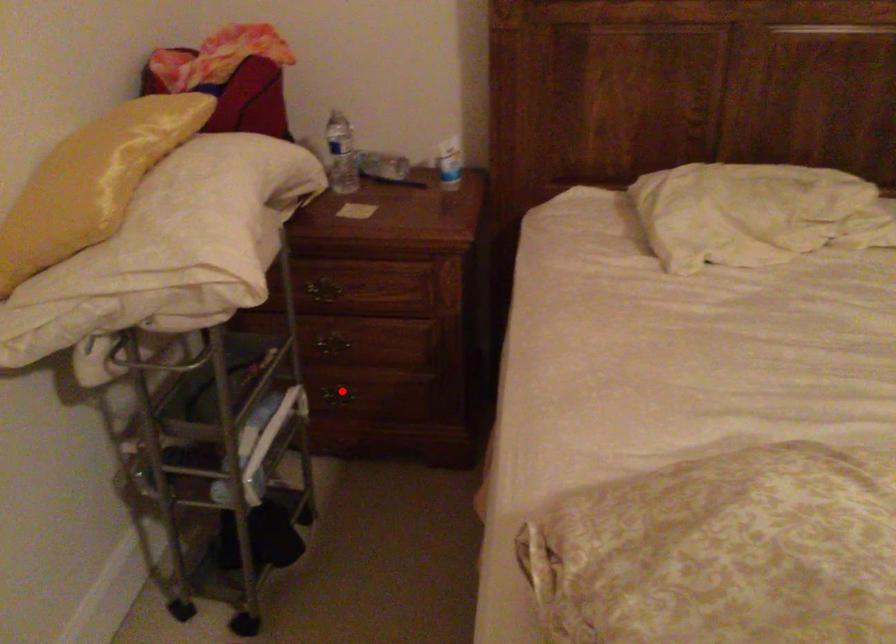
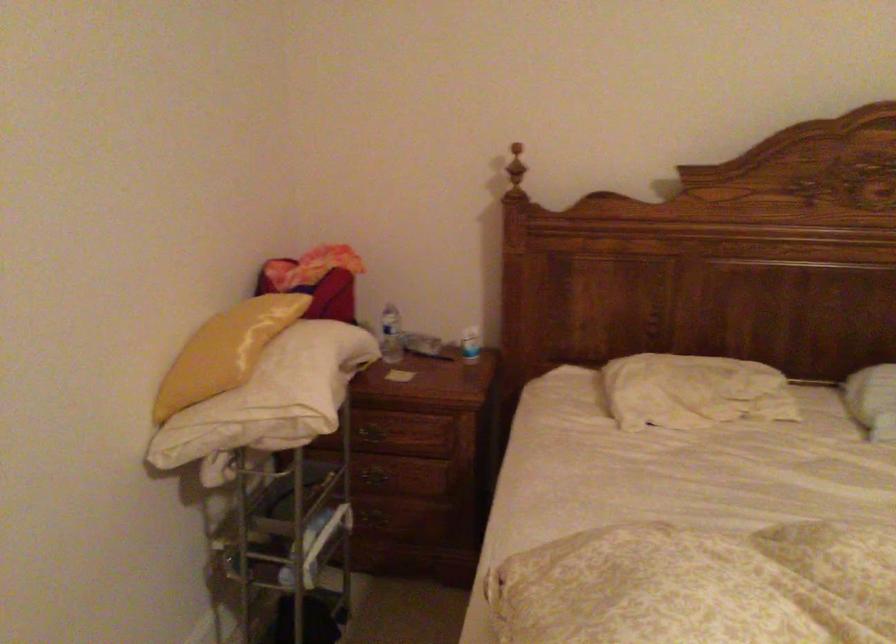
Question: I am providing you with two images of the same scene from different viewpoints. In image1, a red point is highlighted. Considering the same 3D point in image2, which of the following is correct?

Choices:
 (A) It is closer
 (B) It is farther

Answer: (B)